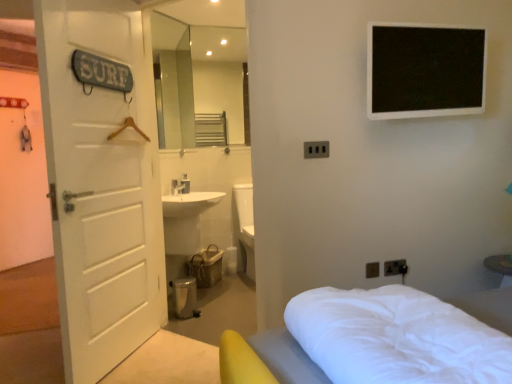
Identify the location of matte black electric outlet at lower right, which ranks as the third electric outlet in top-to-bottom order. (372, 270).

Based on the photo, in order to face white soft bed at lower right, should I rotate leftwards or rightwards?

To face it directly, rotate right by 20.424 degrees.

Describe the element at coordinates (382, 340) in the screenshot. I see `white soft bed at lower right` at that location.

Based on the photo, in order to face black plastic electrical outlet at lower right, which ranks as the 2th electric outlet in top-to-bottom order, should I rotate leftwards or rightwards?

Rotate your view right by about 18.194°.

The image size is (512, 384). I want to click on matte black electric outlet at lower right, placed as the 2th electric outlet when sorted from right to left, so click(372, 270).

Between black plastic electrical outlet at lower right, which ranks as the 2th electric outlet in top-to-bottom order, and matte black electric outlet at lower right, placed as the 2th electric outlet when sorted from back to front, which one appears on the right side from the viewer's perspective?

black plastic electrical outlet at lower right, which ranks as the 2th electric outlet in top-to-bottom order, is more to the right.

From the image's perspective, is black plastic electrical outlet at lower right, acting as the 3th electric outlet starting from the left, located above or below matte black electric outlet at lower right, which ranks as the third electric outlet in top-to-bottom order?

Based on their image positions, black plastic electrical outlet at lower right, acting as the 3th electric outlet starting from the left, is located above matte black electric outlet at lower right, which ranks as the third electric outlet in top-to-bottom order.

Based on the photo, between black plastic electrical outlet at lower right, the 1th electric outlet in the back-to-front sequence, and matte black electric outlet at lower right, which ranks as the 2th electric outlet in left-to-right order, which one is positioned behind?

black plastic electrical outlet at lower right, the 1th electric outlet in the back-to-front sequence, is behind.

From a real-world perspective, between black plastic electrical outlet at lower right, the third electric outlet viewed from the front, and matte black electric outlet at lower right, placed as the 2th electric outlet when sorted from back to front, who is vertically higher?

In real-world perspective, matte black electric outlet at lower right, placed as the 2th electric outlet when sorted from back to front, is above.

Could you tell me if white wooden door at left is turned towards black plastic electrical outlet at lower right, the third electric outlet viewed from the front?

Yes, white wooden door at left faces towards black plastic electrical outlet at lower right, the third electric outlet viewed from the front.

Which object is wider, white wooden door at left or black plastic electrical outlet at lower right, the 1th electric outlet in the back-to-front sequence?

white wooden door at left is wider.

Is white wooden door at left placed right next to black plastic electrical outlet at lower right, acting as the 2th electric outlet starting from the bottom?

No, white wooden door at left is not touching black plastic electrical outlet at lower right, acting as the 2th electric outlet starting from the bottom.

What's the angular difference between black plastic electric outlet at center, which ranks as the third electric outlet in right-to-left order, and white wooden door at left's facing directions?

There is a 59.7-degree angle between the facing directions of black plastic electric outlet at center, which ranks as the third electric outlet in right-to-left order, and white wooden door at left.

Does black plastic electric outlet at center, which ranks as the third electric outlet in right-to-left order, have a larger size compared to white wooden door at left?

Incorrect, black plastic electric outlet at center, which ranks as the third electric outlet in right-to-left order, is not larger than white wooden door at left.

Measure the distance between black plastic electric outlet at center, the 3th electric outlet positioned from the bottom, and white wooden door at left.

black plastic electric outlet at center, the 3th electric outlet positioned from the bottom, is 1.19 meters away from white wooden door at left.

This screenshot has height=384, width=512. What are the coordinates of `electric outlet located above the white wooden door at left (from the image's perspective)` in the screenshot? It's located at (316, 149).

Measure the distance between matte black electric outlet at lower right, acting as the 2th electric outlet starting from the front, and black plastic electrical outlet at lower right, which ranks as the 2th electric outlet in top-to-bottom order.

matte black electric outlet at lower right, acting as the 2th electric outlet starting from the front, is 9.83 centimeters from black plastic electrical outlet at lower right, which ranks as the 2th electric outlet in top-to-bottom order.

From the image's perspective, which object appears higher, matte black electric outlet at lower right, placed as the 2th electric outlet when sorted from back to front, or black plastic electrical outlet at lower right, the third electric outlet viewed from the front?

black plastic electrical outlet at lower right, the third electric outlet viewed from the front, is shown above in the image.

Consider the image. Can you confirm if matte black electric outlet at lower right, which is counted as the 1th electric outlet, starting from the bottom, is wider than black plastic electrical outlet at lower right, acting as the 2th electric outlet starting from the bottom?

Indeed, matte black electric outlet at lower right, which is counted as the 1th electric outlet, starting from the bottom, has a greater width compared to black plastic electrical outlet at lower right, acting as the 2th electric outlet starting from the bottom.

Is matte black electric outlet at lower right, acting as the 2th electric outlet starting from the front, not near black plastic electrical outlet at lower right, which is the first electric outlet from right to left?

No, matte black electric outlet at lower right, acting as the 2th electric outlet starting from the front, is not far from black plastic electrical outlet at lower right, which is the first electric outlet from right to left.

Does black plastic electrical outlet at lower right, the third electric outlet viewed from the front, lie behind white wooden door at left?

Yes.

Can you confirm if black plastic electrical outlet at lower right, which is the first electric outlet from right to left, is positioned to the right of white wooden door at left?

Yes.

Who is smaller, black plastic electrical outlet at lower right, which ranks as the 2th electric outlet in top-to-bottom order, or white wooden door at left?

black plastic electrical outlet at lower right, which ranks as the 2th electric outlet in top-to-bottom order.

From the image's perspective, is black plastic electrical outlet at lower right, acting as the 3th electric outlet starting from the left, above or below white wooden door at left?

Clearly, from the image's perspective, black plastic electrical outlet at lower right, acting as the 3th electric outlet starting from the left, is below white wooden door at left.

Is black plastic electric outlet at center, the first electric outlet in the front-to-back sequence, oriented away from black plastic electrical outlet at lower right, which is the first electric outlet from right to left?

No, black plastic electric outlet at center, the first electric outlet in the front-to-back sequence,'s orientation is not away from black plastic electrical outlet at lower right, which is the first electric outlet from right to left.

Does black plastic electric outlet at center, arranged as the first electric outlet when viewed from the left, touch black plastic electrical outlet at lower right, the third electric outlet viewed from the front?

They are not placed beside each other.

Looking at this image, would you say black plastic electric outlet at center, marked as the third electric outlet in a back-to-front arrangement, contains black plastic electrical outlet at lower right, the 1th electric outlet in the back-to-front sequence?

No.

Identify the location of electric outlet that is the 2nd object above the black plastic electrical outlet at lower right, which is the first electric outlet from right to left (from a real-world perspective). The height and width of the screenshot is (384, 512). (316, 149).

Is white wooden door at left next to white soft bed at lower right?

No, white wooden door at left is not beside white soft bed at lower right.

Looking at this image, which object is further away from the camera taking this photo, white wooden door at left or white soft bed at lower right?

white wooden door at left is further from the camera.

What's the angular difference between white wooden door at left and white soft bed at lower right's facing directions?

150 degrees separate the facing orientations of white wooden door at left and white soft bed at lower right.

Could you tell me if white wooden door at left is facing white soft bed at lower right?

No, white wooden door at left is not facing towards white soft bed at lower right.

Find the location of a particular element. Image resolution: width=512 pixels, height=384 pixels. electric outlet below the matte black electric outlet at lower right, acting as the 2th electric outlet starting from the front (from a real-world perspective) is located at coordinates (395, 267).

The width and height of the screenshot is (512, 384). In order to click on door on the left of black plastic electrical outlet at lower right, the 1th electric outlet in the back-to-front sequence in this screenshot , I will do `click(101, 185)`.

From the picture: Which object lies nearer to the anchor point matte black electric outlet at lower right, acting as the 2th electric outlet starting from the front, black plastic electrical outlet at lower right, acting as the 3th electric outlet starting from the left, or white soft bed at lower right?

Among the two, black plastic electrical outlet at lower right, acting as the 3th electric outlet starting from the left, is located nearer to matte black electric outlet at lower right, acting as the 2th electric outlet starting from the front.

Consider the image. Which object lies nearer to the anchor point white wooden door at left, black plastic electrical outlet at lower right, the third electric outlet viewed from the front, or white soft bed at lower right?

white soft bed at lower right.

Looking at the image, which one is located closer to white soft bed at lower right, black plastic electrical outlet at lower right, the third electric outlet viewed from the front, or matte black electric outlet at lower right, which is counted as the 1th electric outlet, starting from the bottom?

The object closer to white soft bed at lower right is matte black electric outlet at lower right, which is counted as the 1th electric outlet, starting from the bottom.

When comparing their distances from black plastic electrical outlet at lower right, which is the first electric outlet from right to left, does white wooden door at left or black plastic electric outlet at center, arranged as the first electric outlet when viewed from the left, seem further?

white wooden door at left is further to black plastic electrical outlet at lower right, which is the first electric outlet from right to left.

From the picture: Estimate the real-world distances between objects in this image. Which object is further from white soft bed at lower right, white wooden door at left or matte black electric outlet at lower right, placed as the 2th electric outlet when sorted from back to front?

Based on the image, white wooden door at left appears to be further to white soft bed at lower right.

Estimate the real-world distances between objects in this image. Which object is closer to white wooden door at left, black plastic electric outlet at center, the 3th electric outlet positioned from the bottom, or white soft bed at lower right?

Among the two, black plastic electric outlet at center, the 3th electric outlet positioned from the bottom, is located nearer to white wooden door at left.

Which object lies further to the anchor point white wooden door at left, matte black electric outlet at lower right, placed as the 2th electric outlet when sorted from back to front, or white soft bed at lower right?

matte black electric outlet at lower right, placed as the 2th electric outlet when sorted from back to front, lies further to white wooden door at left than the other object.

When comparing their distances from black plastic electric outlet at center, the first electric outlet in the front-to-back sequence, does white soft bed at lower right or white wooden door at left seem closer?

white soft bed at lower right is closer to black plastic electric outlet at center, the first electric outlet in the front-to-back sequence.

Locate an element on the screen. This screenshot has height=384, width=512. electric outlet between black plastic electric outlet at center, the 3th electric outlet positioned from the bottom, and matte black electric outlet at lower right, which is counted as the 1th electric outlet, starting from the bottom, in the up-down direction is located at coordinates (395, 267).

Find the location of a particular element. The height and width of the screenshot is (384, 512). door between white soft bed at lower right and black plastic electrical outlet at lower right, the third electric outlet viewed from the front, in the front-back direction is located at coordinates (101, 185).

Find the location of `door positioned between white soft bed at lower right and black plastic electric outlet at center, which ranks as the third electric outlet in right-to-left order, from near to far`. door positioned between white soft bed at lower right and black plastic electric outlet at center, which ranks as the third electric outlet in right-to-left order, from near to far is located at coordinates pos(101,185).

The image size is (512, 384). I want to click on door between white soft bed at lower right and matte black electric outlet at lower right, acting as the 2th electric outlet starting from the front, from front to back, so click(x=101, y=185).